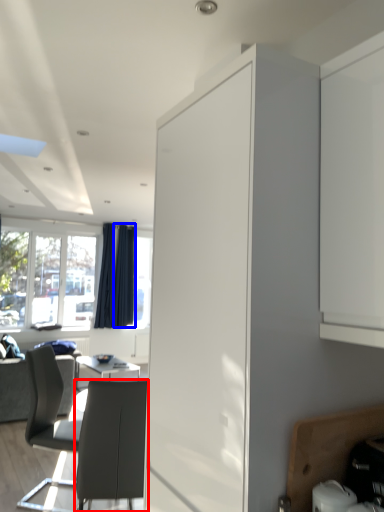
Question: Which point is closer to the camera, chair (highlighted by a red box) or curtain (highlighted by a blue box)?

Choices:
 (A) chair
 (B) curtain

Answer: (A)